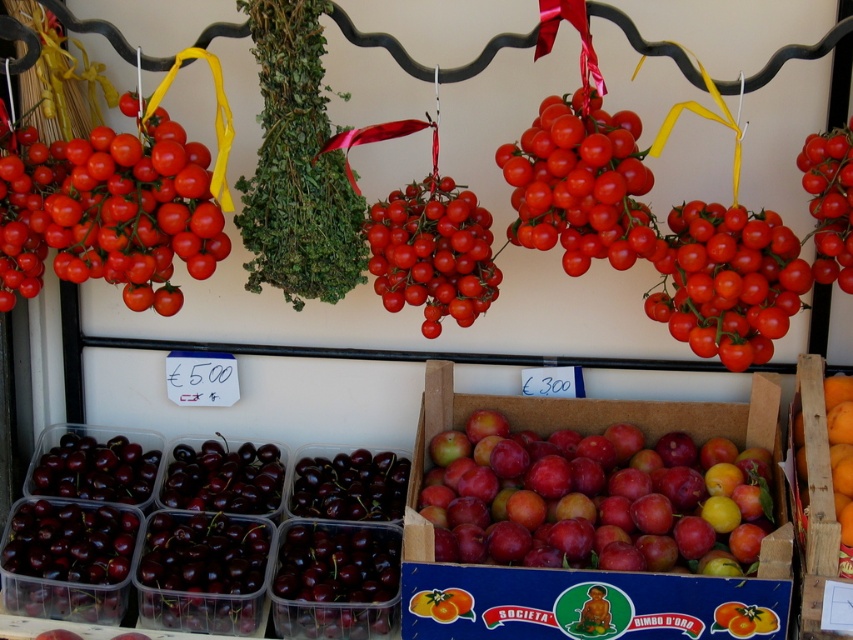
You are a customer at the market stall and want to buy both the dark purple glossy cherries at center and the orange matte wood crate at lower right. Which item takes up more horizontal space on the display?

The dark purple glossy cherries at center are wider than the orange matte wood crate at lower right, so they take up more horizontal space on the display.